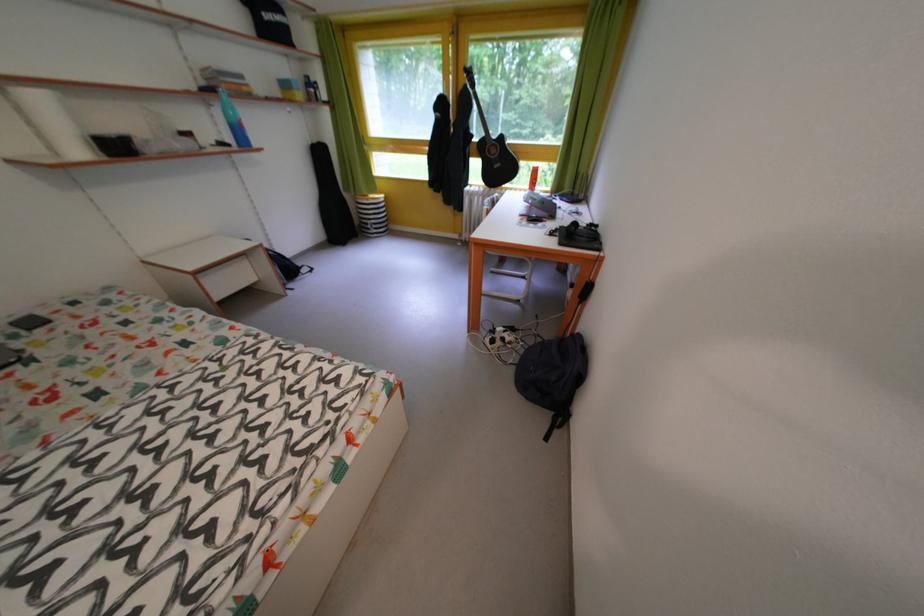
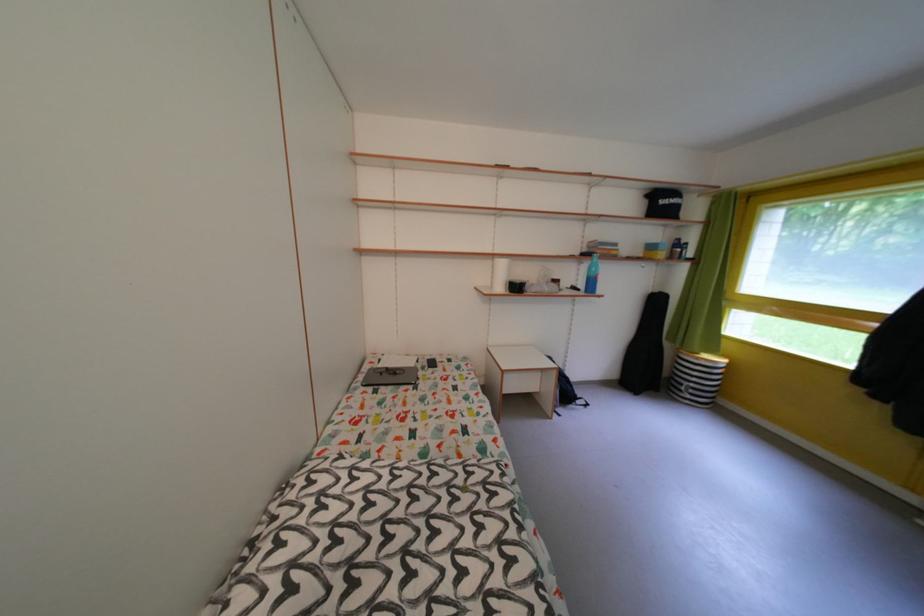
Locate, in the second image, the point that corresponds to [213,89] in the first image.

(594, 256)